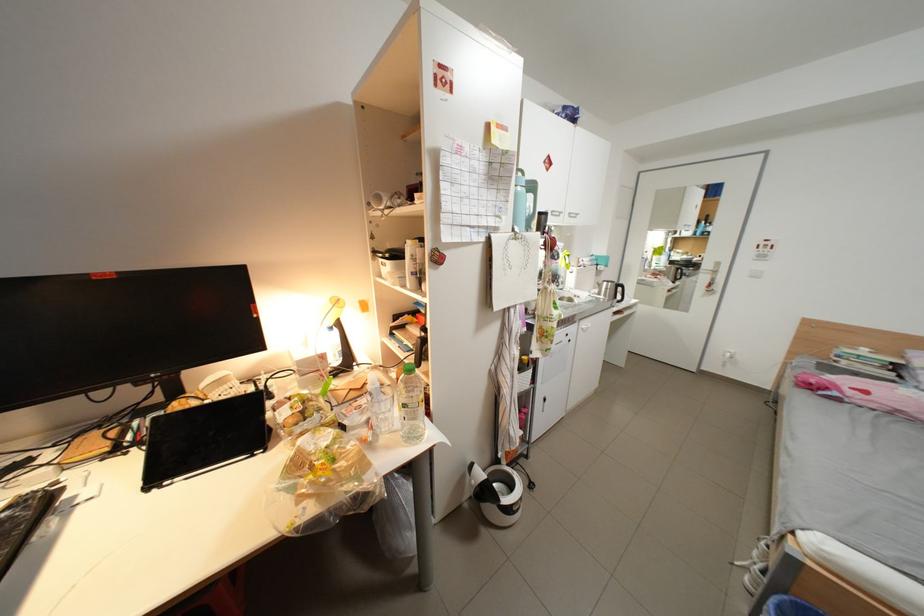
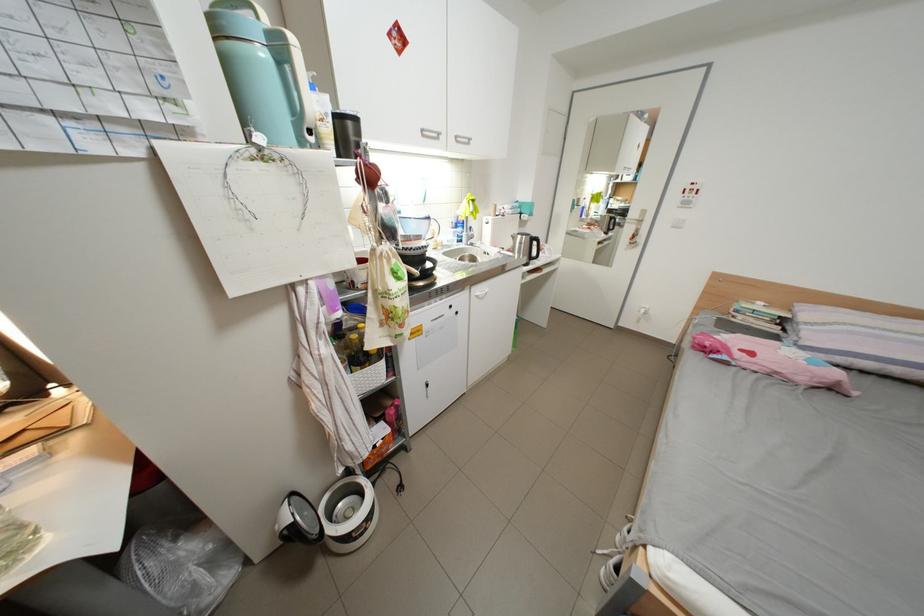
In a continuous first-person perspective shot, in which direction is the camera moving?

The cameraman moved toward right, forward.